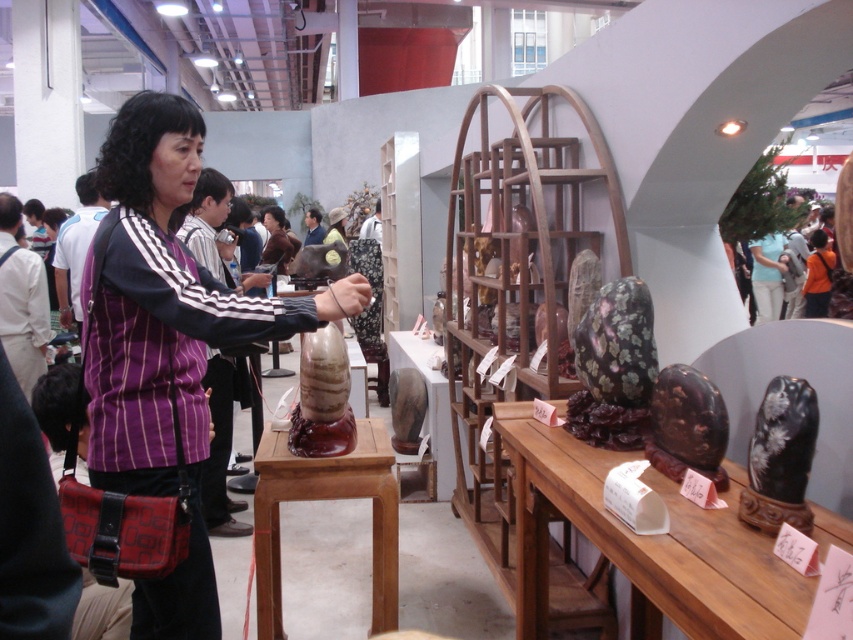
Question: Which of the following is the closest to the observer?

Choices:
 (A) brown polished wood stool at center
 (B) purple striped shirt at center

Answer: (B)

Question: Does purple striped shirt at center appear over brown polished wood stool at center?

Choices:
 (A) no
 (B) yes

Answer: (B)

Question: Is purple striped shirt at center positioned at the back of brown polished wood stool at center?

Choices:
 (A) yes
 (B) no

Answer: (B)

Question: Can you confirm if purple striped shirt at center is positioned to the left of brown polished wood stool at center?

Choices:
 (A) yes
 (B) no

Answer: (A)